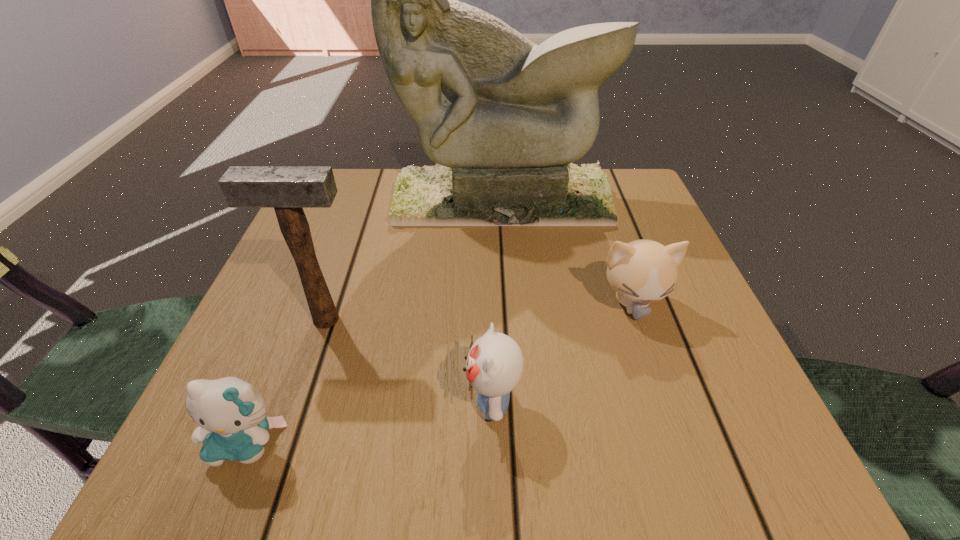
The width and height of the screenshot is (960, 540). In order to click on free spot between the farthest object and the mallet in this screenshot , I will do `click(414, 259)`.

The width and height of the screenshot is (960, 540). What are the coordinates of `free spot between the sculpture and the leftmost kitten` in the screenshot? It's located at (374, 320).

At what (x,y) coordinates should I click in order to perform the action: click on vacant space that's between the mallet and the second kitten from right to left. Please return your answer as a coordinate pair (x, y). The width and height of the screenshot is (960, 540). Looking at the image, I should click on (409, 361).

This screenshot has height=540, width=960. Identify the location of vacant space that's between the second kitten from right to left and the leftmost kitten. (370, 422).

You are a GUI agent. You are given a task and a screenshot of the screen. Output one action in this format:
    pyautogui.click(x=<x>, y=<y>)
    Task: Click on the free space that is in between the tallest object and the fourth shortest object
    Image resolution: width=960 pixels, height=540 pixels.
    Given the screenshot: What is the action you would take?
    pyautogui.click(x=414, y=259)

In order to click on vacant space that's between the leftmost kitten and the fourth shortest object in this screenshot , I will do `click(286, 381)`.

Image resolution: width=960 pixels, height=540 pixels. What are the coordinates of `object that is the fourth closest one to the farthest object` in the screenshot? It's located at (231, 414).

The width and height of the screenshot is (960, 540). Identify the location of object identified as the fourth closest to the sculpture. (231, 414).

Choose which kitten is the second nearest neighbor to the leftmost kitten. Please provide its 2D coordinates. Your answer should be formatted as a tuple, i.e. [(x, y)], where the tuple contains the x and y coordinates of a point satisfying the conditions above.

[(642, 271)]

The height and width of the screenshot is (540, 960). What are the coordinates of `kitten object that ranks as the closest to the farthest kitten` in the screenshot? It's located at click(494, 366).